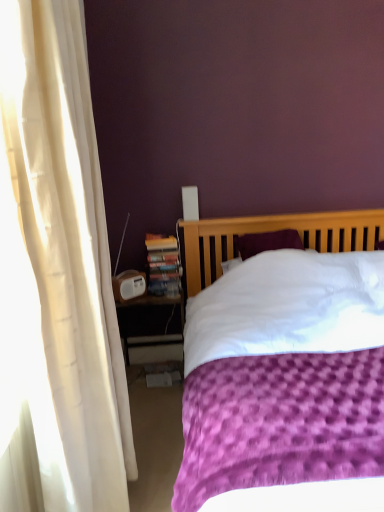
Question: In terms of size, does purple textured bed at center appear bigger or smaller than white plastic nightstand at lower left?

Choices:
 (A) small
 (B) big

Answer: (B)

Question: Considering the positions of purple textured bed at center and white plastic nightstand at lower left in the image, is purple textured bed at center wider or thinner than white plastic nightstand at lower left?

Choices:
 (A) thin
 (B) wide

Answer: (B)

Question: Estimate the real-world distances between objects in this image. Which object is farther from the purple textured bed at center?

Choices:
 (A) hardcover book at left
 (B) white plastic nightstand at lower left

Answer: (B)

Question: Considering the real-world distances, which object is closest to the hardcover book at left?

Choices:
 (A) white plastic nightstand at lower left
 (B) purple textured bed at center

Answer: (A)